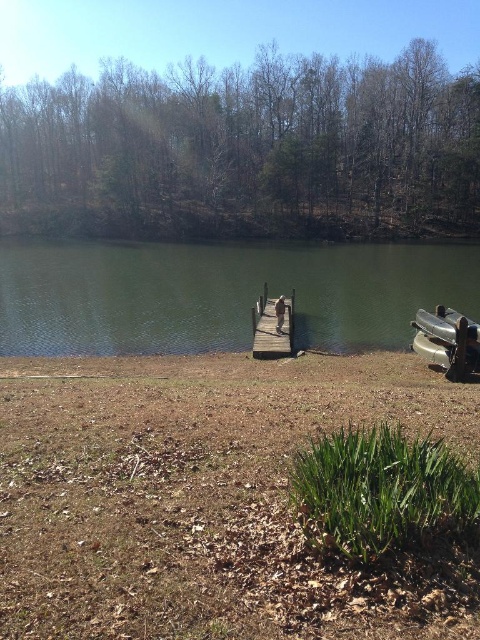
Does brown dry grass at lower left appear on the left side of wooden dock at center?

Incorrect, brown dry grass at lower left is not on the left side of wooden dock at center.

Which is behind, point (154, 509) or point (255, 314)?

The point (255, 314) is behind.

Consider the image. Who is more forward, (274,419) or (290,316)?

Point (274,419)

Image resolution: width=480 pixels, height=640 pixels. Find the location of `brown dry grass at lower left`. brown dry grass at lower left is located at coordinates (196, 496).

Measure the distance between green smooth water at center and wooden dock at center.

They are 15.75 meters apart.

Is green smooth water at center bigger than wooden dock at center?

Correct, green smooth water at center is larger in size than wooden dock at center.

This screenshot has width=480, height=640. What are the coordinates of `green smooth water at center` in the screenshot? It's located at (220, 292).

Can you confirm if green smooth water at center is thinner than metallic gray boat at lower right?

Incorrect, green smooth water at center's width is not less than metallic gray boat at lower right's.

Is point (359, 305) less distant than point (441, 305)?

No, it is not.

Find the location of a particular element. The image size is (480, 640). green smooth water at center is located at coordinates (220, 292).